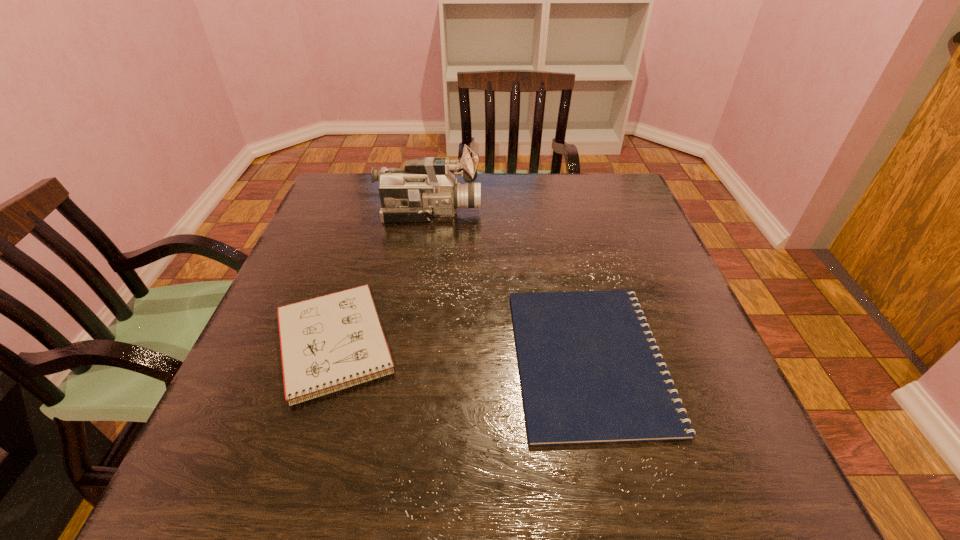
This screenshot has width=960, height=540. Identify the location of empty space between the second tallest object and the rightmost object. (462, 352).

Image resolution: width=960 pixels, height=540 pixels. I want to click on vacant area between the camcorder and the left notepad, so click(382, 278).

What are the coordinates of `free space between the farthest object and the right notepad` in the screenshot? It's located at (510, 285).

Locate an element on the screen. This screenshot has width=960, height=540. free space between the second tallest object and the farthest object is located at coordinates (382, 278).

Locate an element on the screen. This screenshot has height=540, width=960. vacant space in between the farthest object and the shortest object is located at coordinates (510, 285).

Identify the location of blank region between the rightmost object and the taller notepad. This screenshot has height=540, width=960. (462, 352).

You are a GUI agent. You are given a task and a screenshot of the screen. Output one action in this format:
    pyautogui.click(x=<x>, y=<y>)
    Task: Click on the free spot between the shortest object and the second tallest object
    
    Given the screenshot: What is the action you would take?
    pyautogui.click(x=462, y=352)

What are the coordinates of `free space between the right notepad and the left notepad` in the screenshot? It's located at (462, 352).

Identify the location of object that is the second closest to the right notepad. (426, 188).

Identify which object is the closest to the second tallest object. Please provide its 2D coordinates. Your answer should be formatted as a tuple, i.e. [(x, y)], where the tuple contains the x and y coordinates of a point satisfying the conditions above.

[(590, 370)]